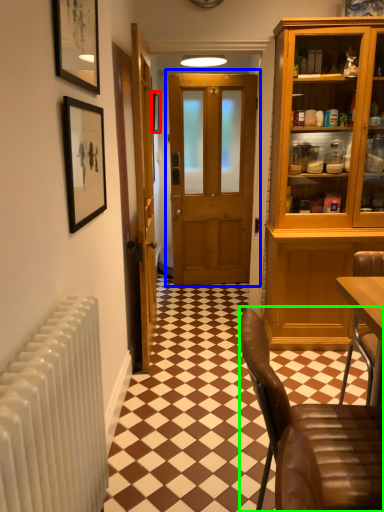
Question: Estimate the real-world distances between objects in this image. Which object is closer to picture frame (highlighted by a red box), door (highlighted by a blue box) or chair (highlighted by a green box)?

Choices:
 (A) door
 (B) chair

Answer: (A)